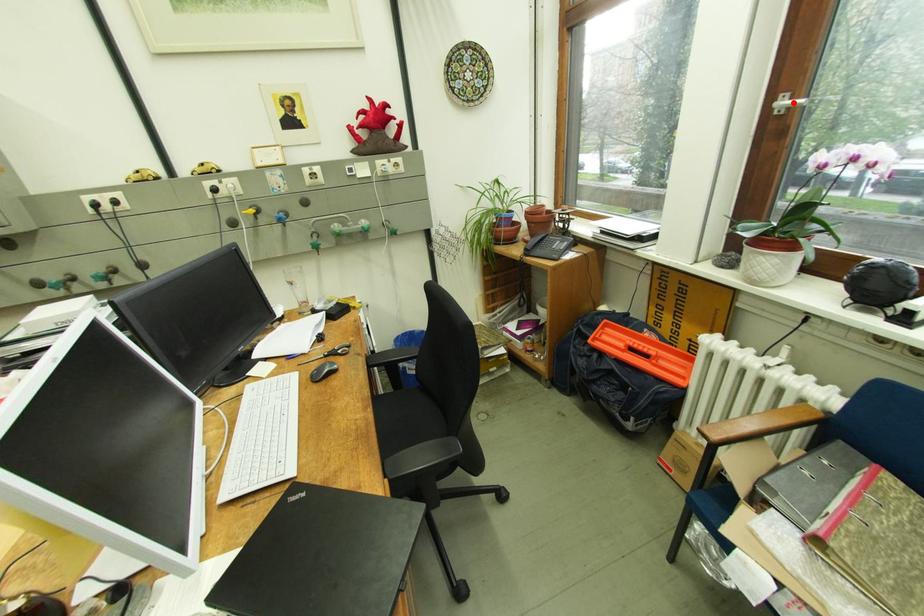
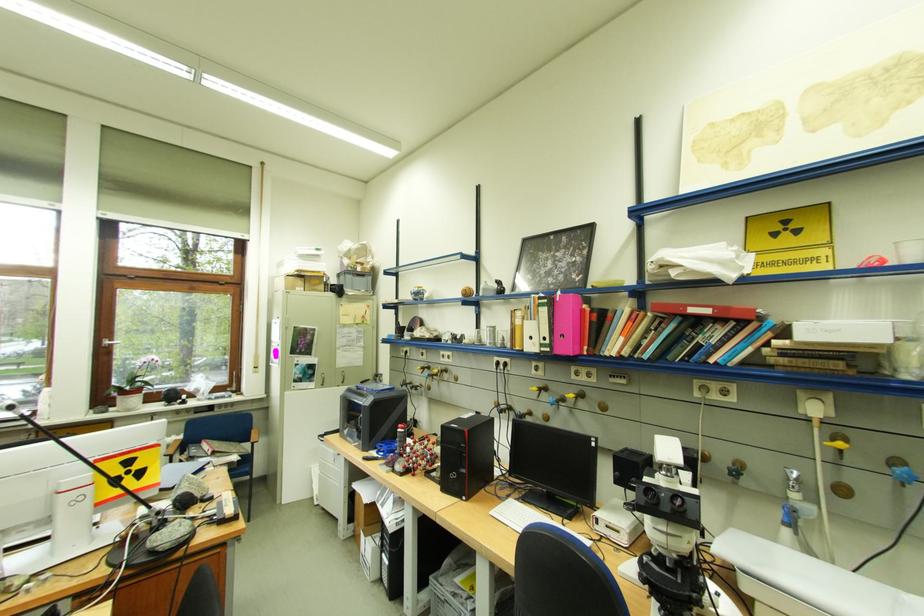
In the second image, find the point that corresponds to the highlighted location in the first image.

(117, 342)